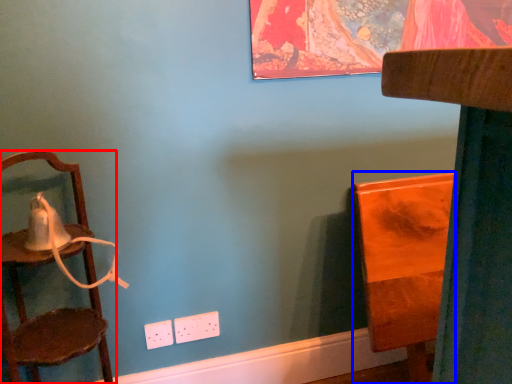
Question: Which of the following is the farthest to the observer, chair (highlighted by a red box) or furniture (highlighted by a blue box)?

Choices:
 (A) chair
 (B) furniture

Answer: (B)